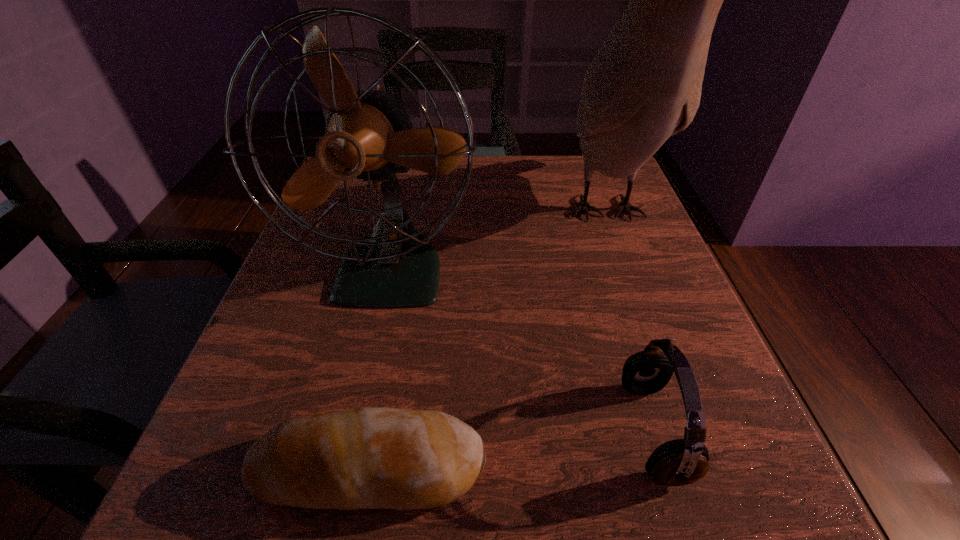
Identify the location of the tallest object. (644, 85).

Locate an element on the screen. Image resolution: width=960 pixels, height=540 pixels. fan is located at coordinates (369, 135).

Find the location of a particular element. The width and height of the screenshot is (960, 540). headset is located at coordinates (678, 462).

Identify the location of the shortest object. This screenshot has height=540, width=960. [x=361, y=458].

In order to click on vacant space positioned on the face of the tallest object in this screenshot , I will do `click(647, 329)`.

The image size is (960, 540). What are the coordinates of `blank space located 0.230m on the front-facing side of the third shortest object for air flow` in the screenshot? It's located at (347, 480).

This screenshot has width=960, height=540. What are the coordinates of `vacant space positioned on the ear cups of the second shortest object` in the screenshot? It's located at (372, 431).

The height and width of the screenshot is (540, 960). Find the location of `free space located on the ear cups of the second shortest object`. free space located on the ear cups of the second shortest object is located at coordinates (400, 431).

At what (x,y) coordinates should I click in order to perform the action: click on vacant space located on the ear cups of the second shortest object. Please return your answer as a coordinate pair (x, y). Image resolution: width=960 pixels, height=540 pixels. Looking at the image, I should click on (473, 431).

Where is `free space located 0.110m on the right of the shortest object`? free space located 0.110m on the right of the shortest object is located at coordinates (571, 469).